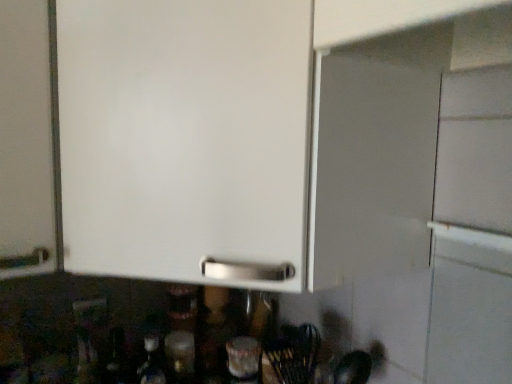
Question: Would you say matte white outlet at lower left is inside or outside translucent glass bottle at lower center?

Choices:
 (A) outside
 (B) inside

Answer: (A)

Question: From a real-world perspective, is matte white outlet at lower left positioned above or below translucent glass bottle at lower center?

Choices:
 (A) below
 (B) above

Answer: (B)

Question: Is matte white outlet at lower left wider or thinner than translucent glass bottle at lower center?

Choices:
 (A) wide
 (B) thin

Answer: (B)

Question: From the image's perspective, relative to matte white outlet at lower left, is translucent glass bottle at lower center above or below?

Choices:
 (A) above
 (B) below

Answer: (B)

Question: In the image, is translucent glass bottle at lower center positioned in front of or behind matte white outlet at lower left?

Choices:
 (A) front
 (B) behind

Answer: (B)

Question: Is translucent glass bottle at lower center situated inside matte white outlet at lower left or outside?

Choices:
 (A) outside
 (B) inside

Answer: (A)

Question: From their relative heights in the image, would you say translucent glass bottle at lower center is taller or shorter than matte white outlet at lower left?

Choices:
 (A) short
 (B) tall

Answer: (B)